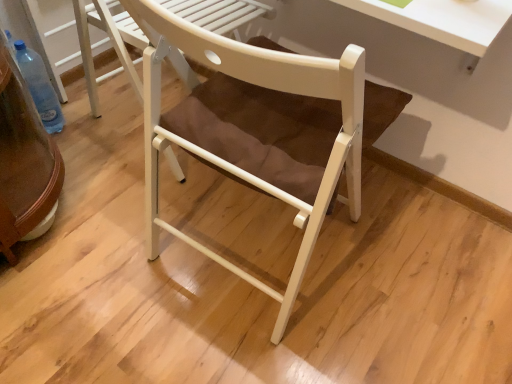
Where is `white matte chair at center, the 2th chair when ordered from front to back`? white matte chair at center, the 2th chair when ordered from front to back is located at coordinates (112, 41).

Which object is positioned more to the right, white wood chair at center, which is counted as the second chair, starting from the back, or transparent plastic bottle at lower left?

white wood chair at center, which is counted as the second chair, starting from the back.

What's the angular difference between white wood chair at center, which is counted as the second chair, starting from the back, and transparent plastic bottle at lower left's facing directions?

The facing directions of white wood chair at center, which is counted as the second chair, starting from the back, and transparent plastic bottle at lower left are 90.1 degrees apart.

Is white wood chair at center, which is counted as the second chair, starting from the back, next to transparent plastic bottle at lower left?

They are not placed beside each other.

Would you say white matte chair at center, positioned as the 1th chair in back-to-front order, is to the left or to the right of transparent plastic bottle at lower left in the picture?

Based on their positions, white matte chair at center, positioned as the 1th chair in back-to-front order, is located to the right of transparent plastic bottle at lower left.

Can you confirm if white matte chair at center, positioned as the 1th chair in back-to-front order, is wider than transparent plastic bottle at lower left?

Indeed, white matte chair at center, positioned as the 1th chair in back-to-front order, has a greater width compared to transparent plastic bottle at lower left.

Locate an element on the screen. Image resolution: width=512 pixels, height=384 pixels. the 1st chair in front when counting from the transparent plastic bottle at lower left is located at coordinates (112, 41).

Is white matte chair at center, the 2th chair when ordered from front to back, positioned beyond the bounds of transparent plastic bottle at lower left?

That's correct, white matte chair at center, the 2th chair when ordered from front to back, is outside of transparent plastic bottle at lower left.

Is white wood chair at center, arranged as the 1th chair when viewed from the front, placed right next to white matte chair at center, the 2th chair when ordered from front to back?

No, white wood chair at center, arranged as the 1th chair when viewed from the front, is not with white matte chair at center, the 2th chair when ordered from front to back.

Considering the relative sizes of white wood chair at center, which is counted as the second chair, starting from the back, and white matte chair at center, positioned as the 1th chair in back-to-front order, in the image provided, is white wood chair at center, which is counted as the second chair, starting from the back, smaller than white matte chair at center, positioned as the 1th chair in back-to-front order,?

No.

Is white wood chair at center, arranged as the 1th chair when viewed from the front, oriented away from white matte chair at center, positioned as the 1th chair in back-to-front order?

No, white matte chair at center, positioned as the 1th chair in back-to-front order, is not at the back of white wood chair at center, arranged as the 1th chair when viewed from the front.

From a real-world perspective, who is located lower, white wood chair at center, which is counted as the second chair, starting from the back, or white matte chair at center, the 2th chair when ordered from front to back?

From a 3D spatial view, white matte chair at center, the 2th chair when ordered from front to back, is below.

Is point (56, 109) positioned after point (153, 163)?

Yes, point (56, 109) is farther from viewer.

From the image's perspective, would you say transparent plastic bottle at lower left is shown under white wood chair at center, which is counted as the second chair, starting from the back?

No, from the image's perspective, transparent plastic bottle at lower left is not below white wood chair at center, which is counted as the second chair, starting from the back.

Considering the positions of objects transparent plastic bottle at lower left and white wood chair at center, arranged as the 1th chair when viewed from the front, in the image provided, who is more to the left, transparent plastic bottle at lower left or white wood chair at center, arranged as the 1th chair when viewed from the front,?

From the viewer's perspective, transparent plastic bottle at lower left appears more on the left side.

Could you measure the distance between transparent plastic bottle at lower left and white wood chair at center, which is counted as the second chair, starting from the back?

They are 81.87 centimeters apart.

Looking at this image, from the image's perspective, is transparent plastic bottle at lower left on top of white matte chair at center, positioned as the 1th chair in back-to-front order?

No, from the image's perspective, transparent plastic bottle at lower left is not above white matte chair at center, positioned as the 1th chair in back-to-front order.

Would you say transparent plastic bottle at lower left is a long distance from white matte chair at center, the 2th chair when ordered from front to back?

No, transparent plastic bottle at lower left is in close proximity to white matte chair at center, the 2th chair when ordered from front to back.

In the scene shown: Is transparent plastic bottle at lower left inside or outside of white matte chair at center, positioned as the 1th chair in back-to-front order?

transparent plastic bottle at lower left lies outside white matte chair at center, positioned as the 1th chair in back-to-front order.

Measure the distance from transparent plastic bottle at lower left to white matte chair at center, positioned as the 1th chair in back-to-front order.

transparent plastic bottle at lower left is 12.41 inches away from white matte chair at center, positioned as the 1th chair in back-to-front order.

Is point (87, 53) farther from viewer compared to point (298, 199)?

Yes, point (87, 53) is farther from viewer.

Does white matte chair at center, the 2th chair when ordered from front to back, appear on the left side of white wood chair at center, arranged as the 1th chair when viewed from the front?

Correct, you'll find white matte chair at center, the 2th chair when ordered from front to back, to the left of white wood chair at center, arranged as the 1th chair when viewed from the front.

In the scene shown: Looking at their sizes, would you say white matte chair at center, the 2th chair when ordered from front to back, is wider or thinner than white wood chair at center, which is counted as the second chair, starting from the back?

Considering their sizes, white matte chair at center, the 2th chair when ordered from front to back, looks broader than white wood chair at center, which is counted as the second chair, starting from the back.

Image resolution: width=512 pixels, height=384 pixels. Find the location of `bottle below the white wood chair at center, arranged as the 1th chair when viewed from the front (from a real-world perspective)`. bottle below the white wood chair at center, arranged as the 1th chair when viewed from the front (from a real-world perspective) is located at coordinates (39, 87).

This screenshot has height=384, width=512. There is a transparent plastic bottle at lower left. In order to click on the 1st chair above it (from a real-world perspective) in this screenshot , I will do `click(112, 41)`.

From the image, which object appears to be nearer to transparent plastic bottle at lower left, white matte chair at center, positioned as the 1th chair in back-to-front order, or white wood chair at center, which is counted as the second chair, starting from the back?

The object closer to transparent plastic bottle at lower left is white matte chair at center, positioned as the 1th chair in back-to-front order.

Based on their spatial positions, is transparent plastic bottle at lower left or white wood chair at center, which is counted as the second chair, starting from the back, further from white matte chair at center, positioned as the 1th chair in back-to-front order?

Among the two, white wood chair at center, which is counted as the second chair, starting from the back, is located further to white matte chair at center, positioned as the 1th chair in back-to-front order.

Considering their positions, is transparent plastic bottle at lower left positioned closer to white wood chair at center, which is counted as the second chair, starting from the back, than white matte chair at center, the 2th chair when ordered from front to back?

white matte chair at center, the 2th chair when ordered from front to back, lies closer to white wood chair at center, which is counted as the second chair, starting from the back, than the other object.

Which object lies further to the anchor point white wood chair at center, arranged as the 1th chair when viewed from the front, white matte chair at center, the 2th chair when ordered from front to back, or transparent plastic bottle at lower left?

transparent plastic bottle at lower left is positioned further to the anchor white wood chair at center, arranged as the 1th chair when viewed from the front.

Based on their spatial positions, is white wood chair at center, arranged as the 1th chair when viewed from the front, or white matte chair at center, the 2th chair when ordered from front to back, further from transparent plastic bottle at lower left?

white wood chair at center, arranged as the 1th chair when viewed from the front, is further to transparent plastic bottle at lower left.

From the image, which object appears to be nearer to white matte chair at center, positioned as the 1th chair in back-to-front order, white wood chair at center, which is counted as the second chair, starting from the back, or transparent plastic bottle at lower left?

Based on the image, transparent plastic bottle at lower left appears to be nearer to white matte chair at center, positioned as the 1th chair in back-to-front order.

Identify the location of chair positioned between white wood chair at center, which is counted as the second chair, starting from the back, and transparent plastic bottle at lower left from near to far. (112, 41).